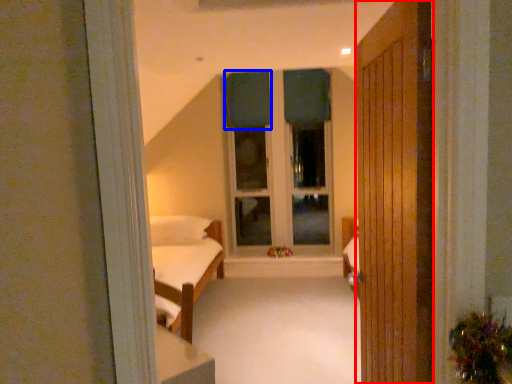
Question: Which object appears closest to the camera in this image, door (highlighted by a red box) or curtain (highlighted by a blue box)?

Choices:
 (A) door
 (B) curtain

Answer: (A)